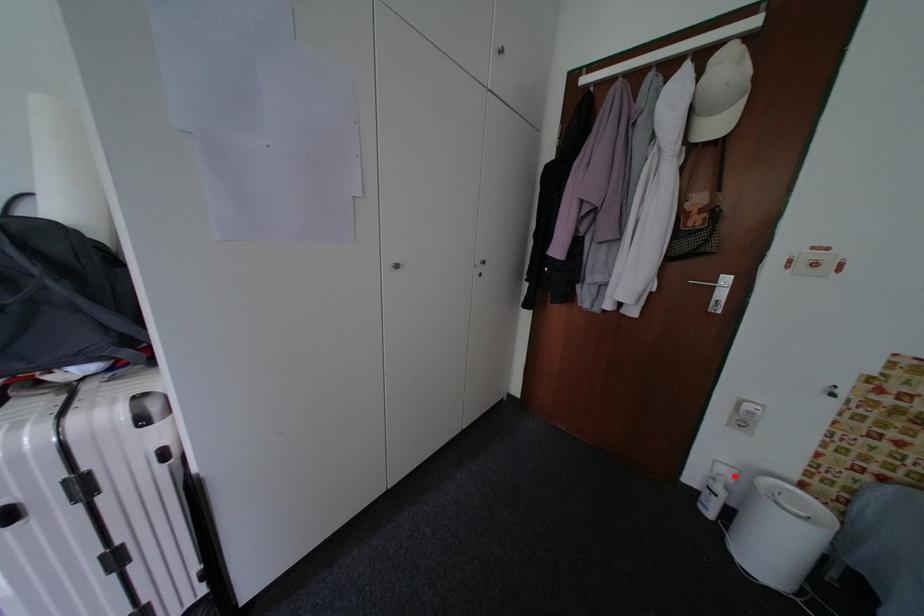
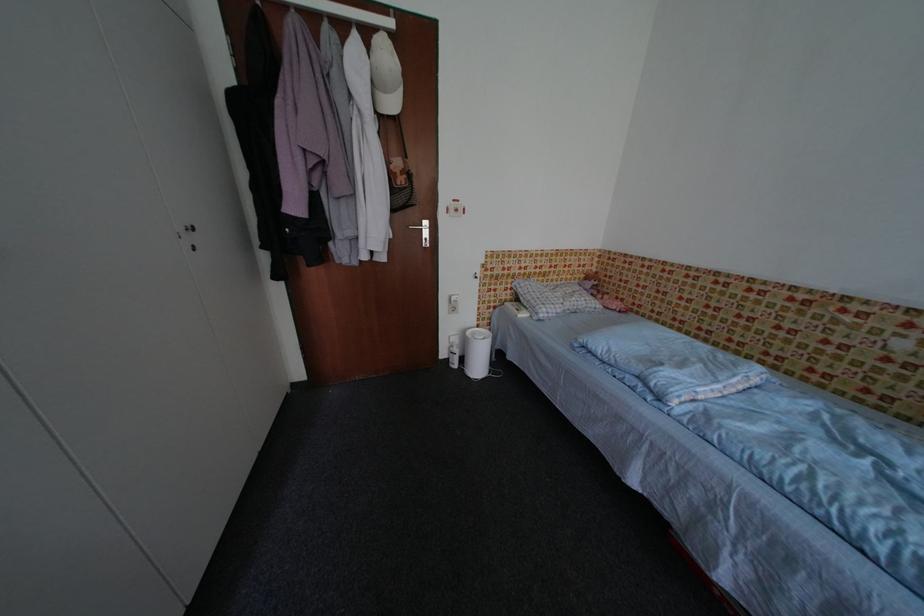
Question: I am providing you with two images of the same scene from different viewpoints. Image1 has a red point marked. In image2, the corresponding 3D location appears at what relative position? Reply with the corresponding letter.

Choices:
 (A) Closer
 (B) Farther

Answer: (B)